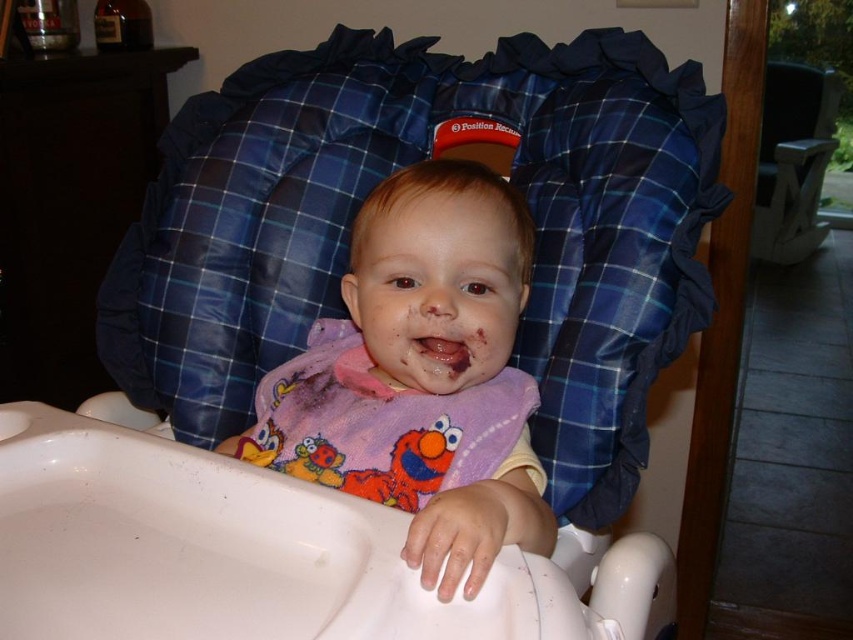
You are taking a photo of the baby in the high chair. There are two points of interest in the image labeled as point 1 at coordinates point (x=281, y=412) and point 2 at coordinates point (x=447, y=337). Which point is closer to the camera?

Point (x=281, y=412) is further to the camera than point (x=447, y=337), so the closer point to the camera is point (x=447, y=337).

You are a parent trying to choose between the purple fleece bib at center and the matte purple bib at center for your baby. Which one is positioned to the left?

The purple fleece bib at center is positioned to the left of the matte purple bib at center.